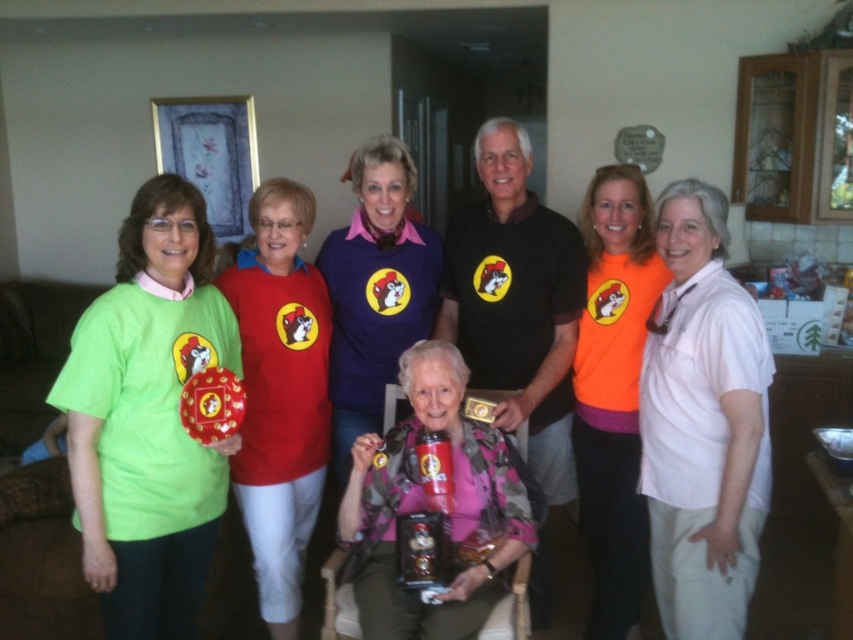
Does matte red shirt at center have a lesser width compared to pink fabric jacket at center?

Indeed, matte red shirt at center has a lesser width compared to pink fabric jacket at center.

Is matte red shirt at center in front of pink fabric jacket at center?

No, it is behind pink fabric jacket at center.

Find the location of a particular element. matte red shirt at center is located at coordinates (280, 394).

The image size is (853, 640). What are the coordinates of `matte red shirt at center` in the screenshot? It's located at (280, 394).

Between matte red shirt at center and orange fleece sweater at center, which one has more height?

orange fleece sweater at center is taller.

Between matte red shirt at center and orange fleece sweater at center, which one has less height?

Standing shorter between the two is matte red shirt at center.

Between point (285, 428) and point (637, 168), which one is positioned behind?

The point (637, 168) is behind.

What are the coordinates of `matte red shirt at center` in the screenshot? It's located at (280, 394).

Measure the distance between matte green t-shirt at left and pink fabric jacket at center.

matte green t-shirt at left is 21.38 inches from pink fabric jacket at center.

Does point (165, 618) come farther from viewer compared to point (416, 344)?

No, (165, 618) is closer to viewer.

Where is `matte green t-shirt at left`? The width and height of the screenshot is (853, 640). matte green t-shirt at left is located at coordinates (148, 419).